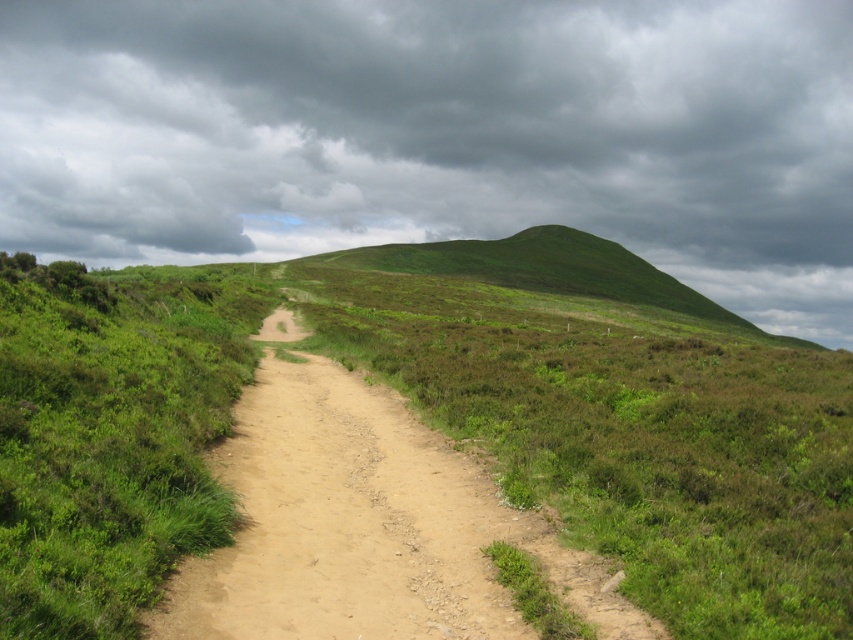
You are standing at the start of the brown sandy dirt track at center and want to reach the green grassy hill at upper center. Which direction should you walk to stay on the path while approaching the hill?

The green grassy hill at upper center is positioned on the right side of the brown sandy dirt track at center, so you should walk to the right along the brown sandy dirt track at center to approach the hill.

You are standing at the starting point of the dirt path in the foreground. If you want to reach the green grassy hill at upper center, which direction should you head towards?

The green grassy hill at upper center is located at point (440, 134), so you should head towards the upper center direction to reach it.

You are standing at the point with coordinates (440, 134) in the image. Based on the scene description, what type of terrain are you currently standing on?

The point with coordinates (440, 134) is on a green grassy hill at upper center, so you are standing on a grassy hill.